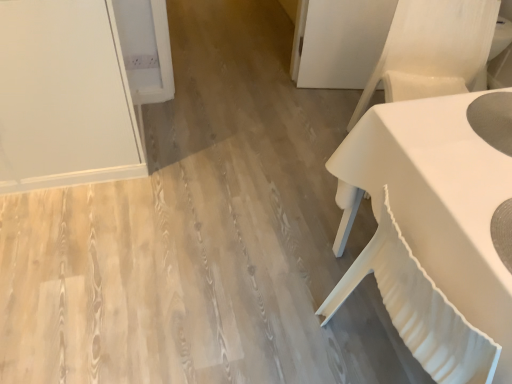
Question: From a real-world perspective, is white fabric armchair at right positioned above or below white matte table at right?

Choices:
 (A) below
 (B) above

Answer: (B)

Question: Considering the positions of white fabric armchair at right and white matte table at right in the image, is white fabric armchair at right bigger or smaller than white matte table at right?

Choices:
 (A) small
 (B) big

Answer: (A)

Question: Is white fabric armchair at right wider or thinner than white matte table at right?

Choices:
 (A) thin
 (B) wide

Answer: (A)

Question: From the image's perspective, is white matte table at right located above or below white fabric armchair at right?

Choices:
 (A) above
 (B) below

Answer: (B)

Question: In terms of width, does white matte table at right look wider or thinner when compared to white fabric armchair at right?

Choices:
 (A) thin
 (B) wide

Answer: (B)

Question: In terms of size, does white matte table at right appear bigger or smaller than white fabric armchair at right?

Choices:
 (A) small
 (B) big

Answer: (B)

Question: In terms of height, does white matte table at right look taller or shorter compared to white fabric armchair at right?

Choices:
 (A) short
 (B) tall

Answer: (B)